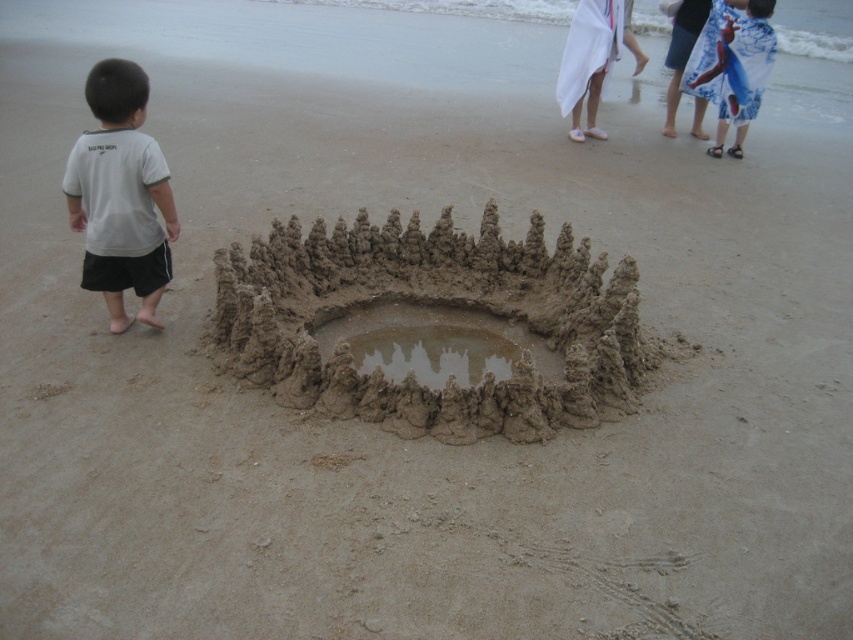
Does blue printed dress at upper right appear on the right side of smooth sand hole at center?

Yes, blue printed dress at upper right is to the right of smooth sand hole at center.

Consider the image. Is blue printed dress at upper right to the left of smooth sand hole at center from the viewer's perspective?

No, blue printed dress at upper right is not to the left of smooth sand hole at center.

Is point (724, 13) less distant than point (445, 371)?

No, (724, 13) is behind (445, 371).

Locate an element on the screen. blue printed dress at upper right is located at coordinates (732, 67).

Who is positioned more to the right, dry sandcastle at center or blue printed dress at upper right?

blue printed dress at upper right

Is dry sandcastle at center shorter than blue printed dress at upper right?

Yes, dry sandcastle at center is shorter than blue printed dress at upper right.

Where is `dry sandcastle at center`? dry sandcastle at center is located at coordinates (433, 301).

Consider the image. Is dry sandcastle at center thinner than brown sandy hole at center?

In fact, dry sandcastle at center might be wider than brown sandy hole at center.

Can you confirm if dry sandcastle at center is taller than brown sandy hole at center?

Correct, dry sandcastle at center is much taller as brown sandy hole at center.

Who is more forward, (614, 408) or (369, 349)?

Point (614, 408)

Where is `dry sandcastle at center`? dry sandcastle at center is located at coordinates (433, 301).